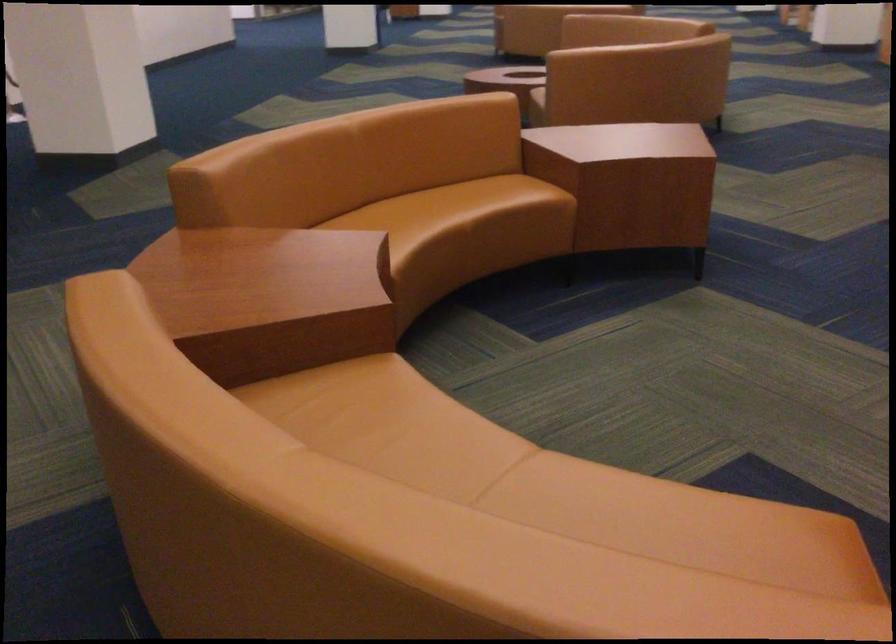
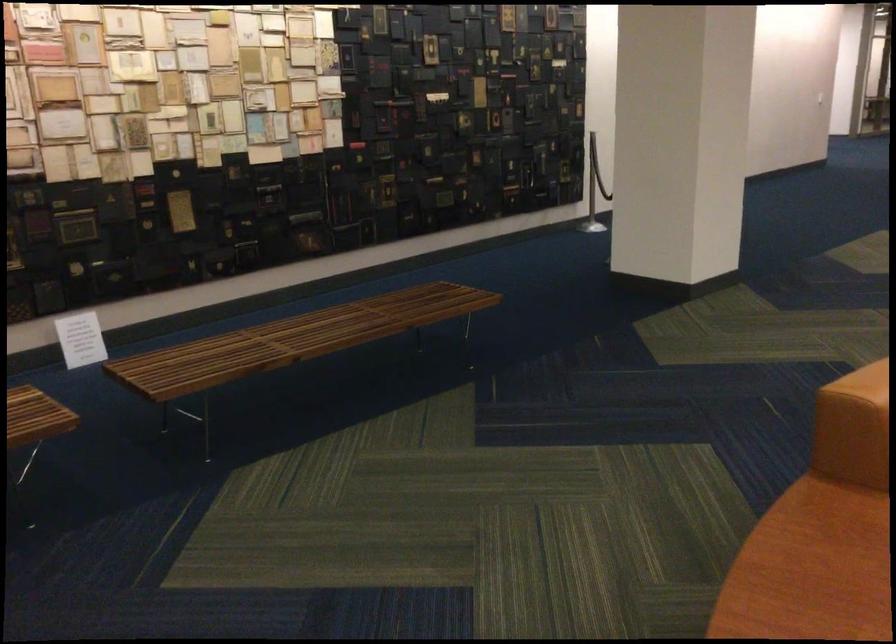
In the second image, find the point that corresponds to pixel 176 277 in the first image.

(808, 570)